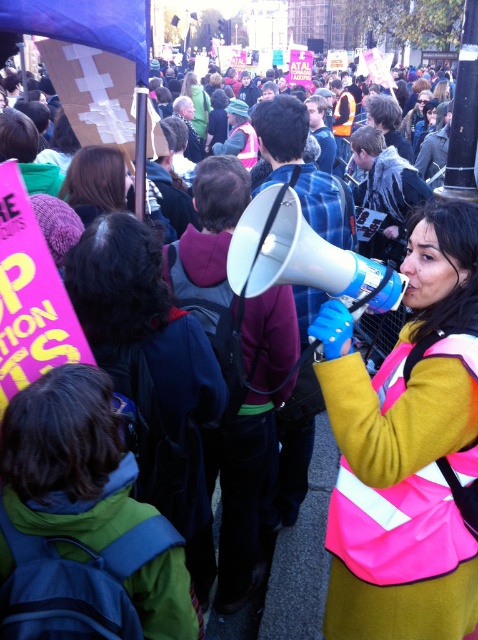
Does neon pink reflective vest at center lie behind blue plastic megaphone at center?

No, neon pink reflective vest at center is in front of blue plastic megaphone at center.

Is point (445, 570) positioned after point (241, 241)?

No, (445, 570) is in front of (241, 241).

Does point (434, 602) come closer to viewer compared to point (324, 285)?

Yes.

Locate an element on the screen. neon pink reflective vest at center is located at coordinates (406, 449).